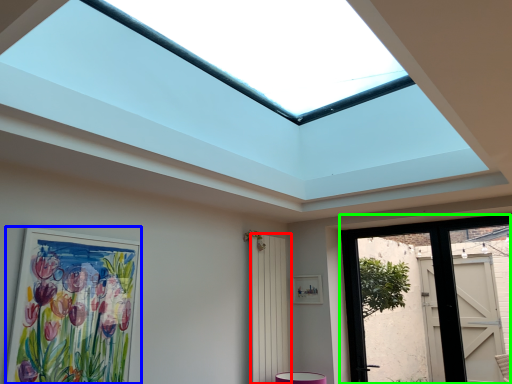
Question: Which is nearer to the screen door (highlighted by a red box)? picture frame (highlighted by a blue box) or door (highlighted by a green box).

Choices:
 (A) picture frame
 (B) door

Answer: (B)